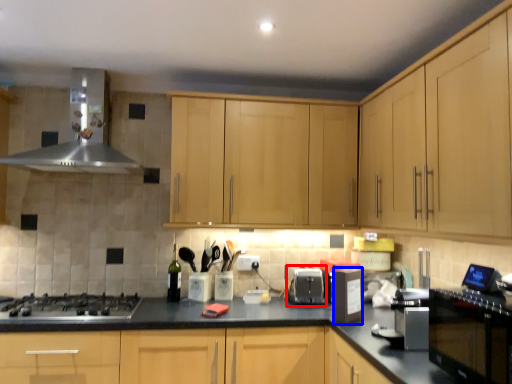
Question: Which point is further to the camera, appliance (highlighted by a red box) or appliance (highlighted by a blue box)?

Choices:
 (A) appliance
 (B) appliance

Answer: (A)